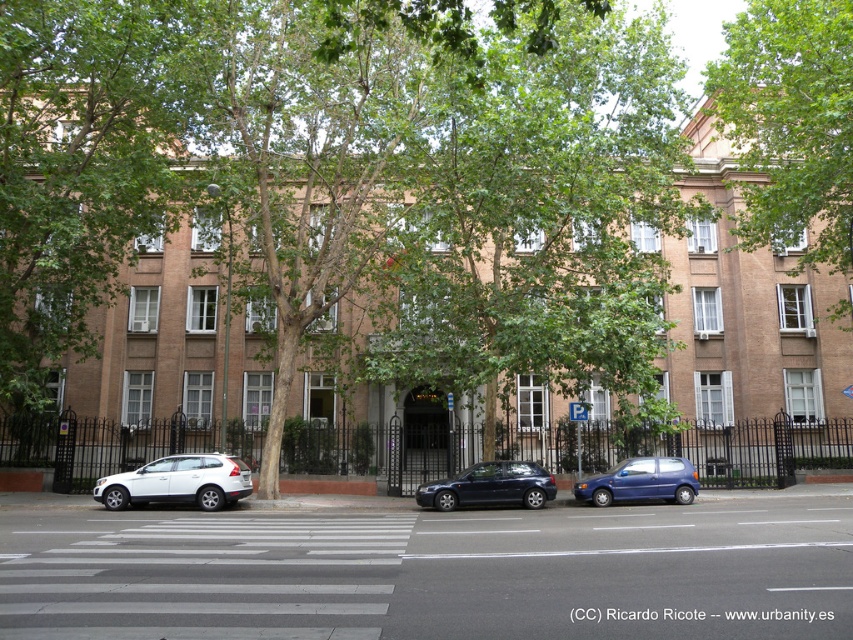
You are standing at the entrance of the building and want to walk to the point marked as point (242,465). Which direction should you go relative to the point (605,502)?

You should walk towards the direction opposite of point (605,502) because point (242,465) is behind it.